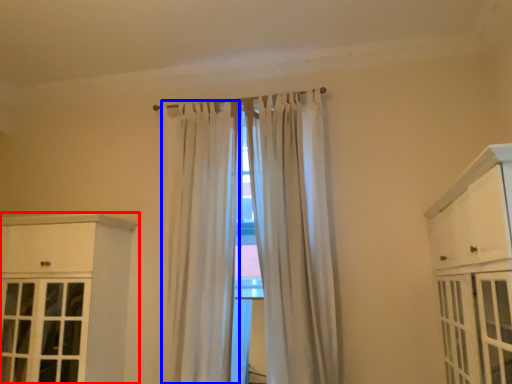
Question: Among these objects, which one is nearest to the camera, cabinetry (highlighted by a red box) or curtain (highlighted by a blue box)?

Choices:
 (A) cabinetry
 (B) curtain

Answer: (A)